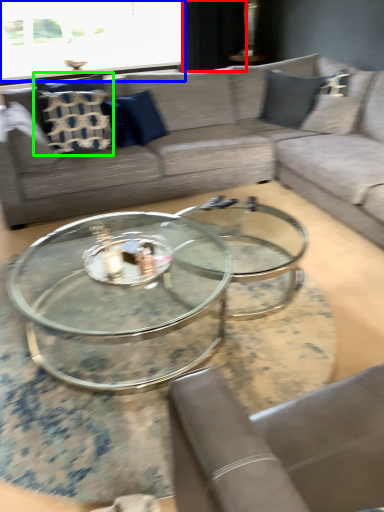
Question: Which object is positioned farthest from curtain (highlighted by a red box)? Select from window screen (highlighted by a blue box) and pillow (highlighted by a green box).

Choices:
 (A) window screen
 (B) pillow

Answer: (B)